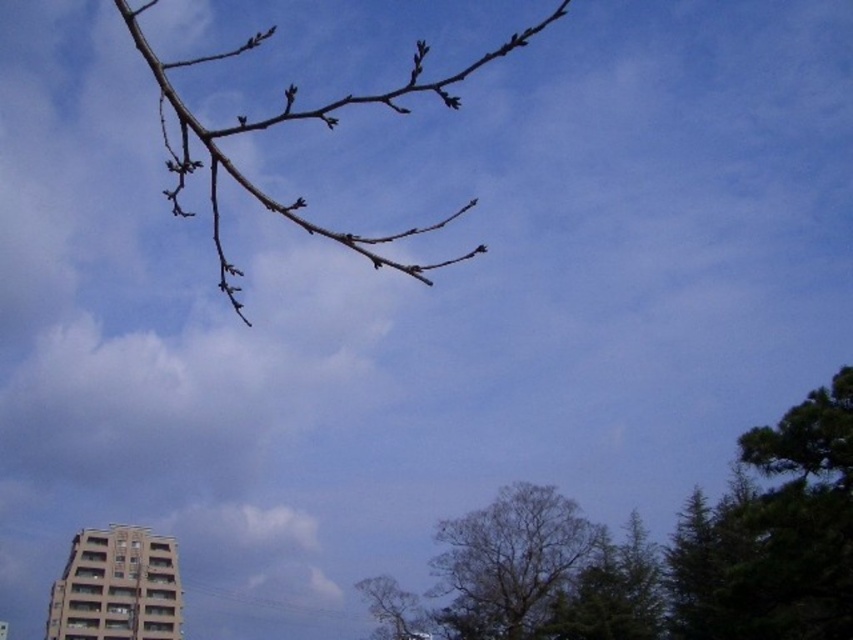
You are planning to hang a bird feeder between the brown textured tree at center and the bare branches at upper center. The feeder requires a minimum of 50 meters of space between the two points to ensure birds can fly freely. Based on the scene description, is the distance sufficient?

The brown textured tree at center and the bare branches at upper center are 43.92 meters apart, which is less than the required 50 meters. Therefore, the distance is insufficient for the bird feeder.

You are standing in the middle of the scene looking towards the top left corner. There is a point labeled as point [659,554]. What object is located at that point?

The point [659,554] indicates the green leafy tree at lower right.

You are an ornithologist observing birds in the scene. You notice a bird flying from the brown textured tree at center towards the green leafy tree at lower right. Which direction is the bird moving relative to the trees?

The bird is moving to the right because the green leafy tree at lower right is positioned to the right of the brown textured tree at center.